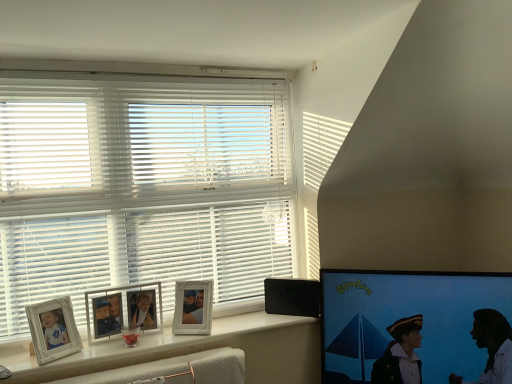
Question: Is matte black screen at right smaller than white matte blinds at upper left?

Choices:
 (A) no
 (B) yes

Answer: (B)

Question: Is matte black screen at right bigger than white matte blinds at upper left?

Choices:
 (A) no
 (B) yes

Answer: (A)

Question: Considering the relative positions of matte black screen at right and white matte blinds at upper left in the image provided, is matte black screen at right in front of white matte blinds at upper left?

Choices:
 (A) yes
 (B) no

Answer: (A)

Question: From the image's perspective, is matte black screen at right located beneath white matte blinds at upper left?

Choices:
 (A) yes
 (B) no

Answer: (A)

Question: Is matte black screen at right next to white matte blinds at upper left?

Choices:
 (A) no
 (B) yes

Answer: (A)

Question: Can you confirm if matte black screen at right is taller than white matte blinds at upper left?

Choices:
 (A) no
 (B) yes

Answer: (A)

Question: From a real-world perspective, is black plastic speaker at lower right positioned over white glossy picture frame at upper center, which appears as the first picture frame when viewed from the right, based on gravity?

Choices:
 (A) no
 (B) yes

Answer: (A)

Question: Considering the relative sizes of black plastic speaker at lower right and white glossy picture frame at upper center, which appears as the first picture frame when viewed from the right, in the image provided, is black plastic speaker at lower right smaller than white glossy picture frame at upper center, which appears as the first picture frame when viewed from the right,?

Choices:
 (A) no
 (B) yes

Answer: (B)

Question: Can you confirm if black plastic speaker at lower right is bigger than white glossy picture frame at upper center, which appears as the first picture frame when viewed from the right?

Choices:
 (A) yes
 (B) no

Answer: (B)

Question: Does black plastic speaker at lower right have a lesser width compared to white glossy picture frame at upper center, which ranks as the 2th picture frame in left-to-right order?

Choices:
 (A) yes
 (B) no

Answer: (A)

Question: Is black plastic speaker at lower right directly adjacent to white glossy picture frame at upper center, which ranks as the 2th picture frame in left-to-right order?

Choices:
 (A) no
 (B) yes

Answer: (A)

Question: Is black plastic speaker at lower right completely or partially outside of white glossy picture frame at upper center, which ranks as the 2th picture frame in left-to-right order?

Choices:
 (A) no
 (B) yes

Answer: (B)

Question: Does black plastic speaker at lower right have a smaller size compared to matte black screen at right?

Choices:
 (A) no
 (B) yes

Answer: (B)